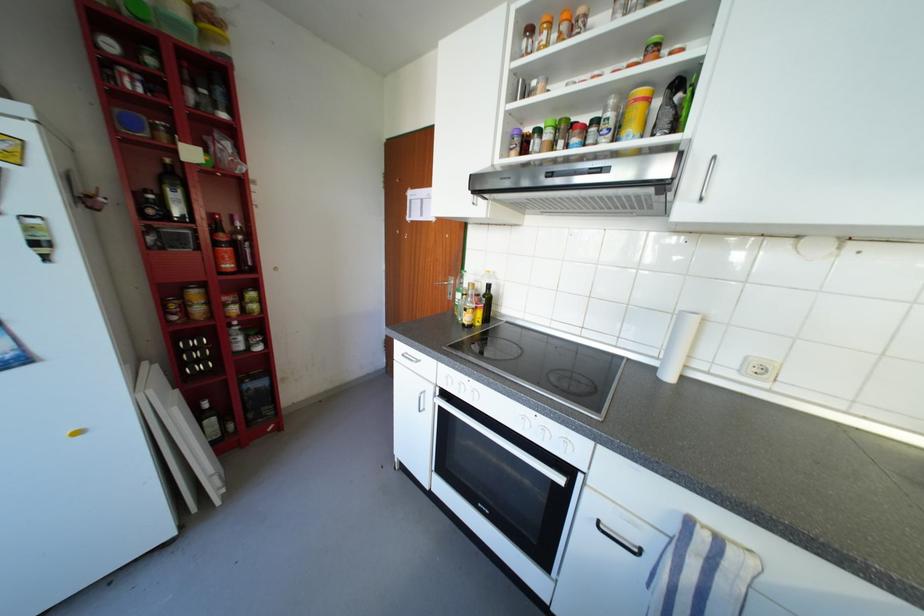
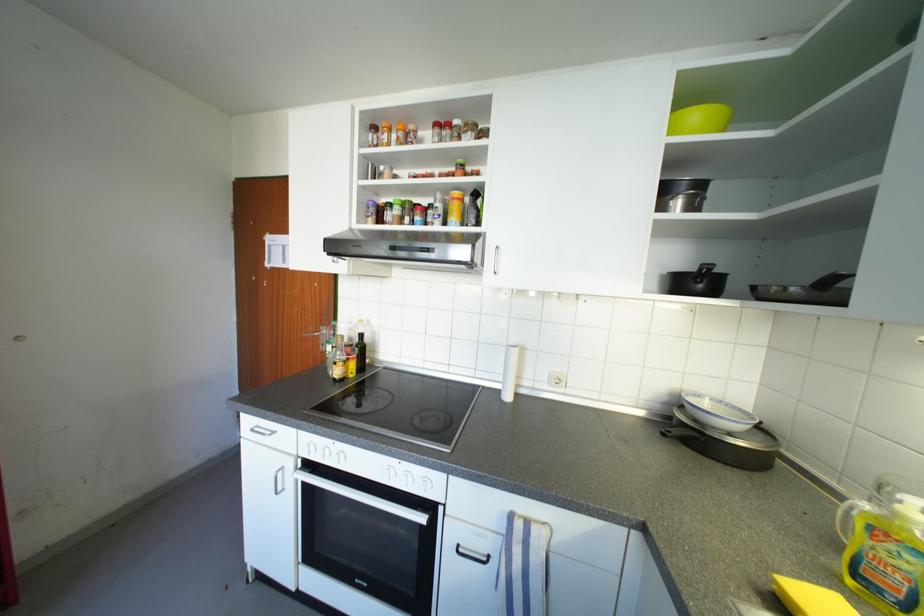
Locate, in the second image, the point that corresponds to (x=518, y=156) in the first image.

(375, 223)